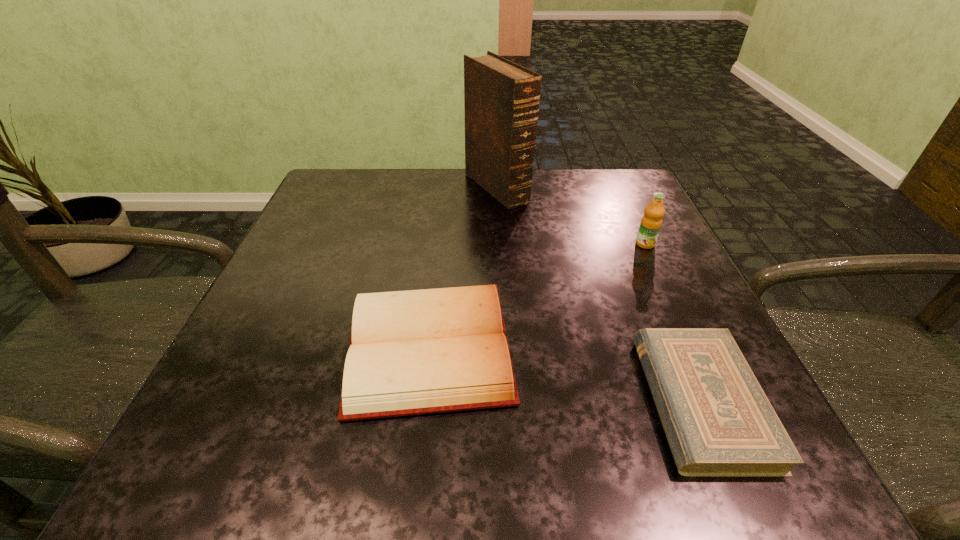
I want to click on free space located 0.320m on the spine side of the shortest object, so click(x=422, y=401).

Locate an element on the screen. This screenshot has height=540, width=960. object present at the far edge is located at coordinates (501, 98).

Where is `orange juice that is positioned at the right edge`? orange juice that is positioned at the right edge is located at coordinates (651, 222).

This screenshot has height=540, width=960. What are the coordinates of `Bible positioned at the right edge` in the screenshot? It's located at (718, 421).

Identify the location of object that is at the near right corner. This screenshot has width=960, height=540. (718, 421).

In the image, there is a desktop. Identify the location of vacant region at the far edge. The height and width of the screenshot is (540, 960). coord(435,205).

In the image, there is a desktop. Where is `vacant area at the near edge`? The image size is (960, 540). vacant area at the near edge is located at coordinates (609, 464).

This screenshot has width=960, height=540. I want to click on vacant space at the left edge of the desktop, so click(319, 316).

In the image, there is a desktop. Identify the location of vacant space at the right edge. The width and height of the screenshot is (960, 540). pos(664,326).

Identify the location of free space at the far left corner of the desktop. (327, 172).